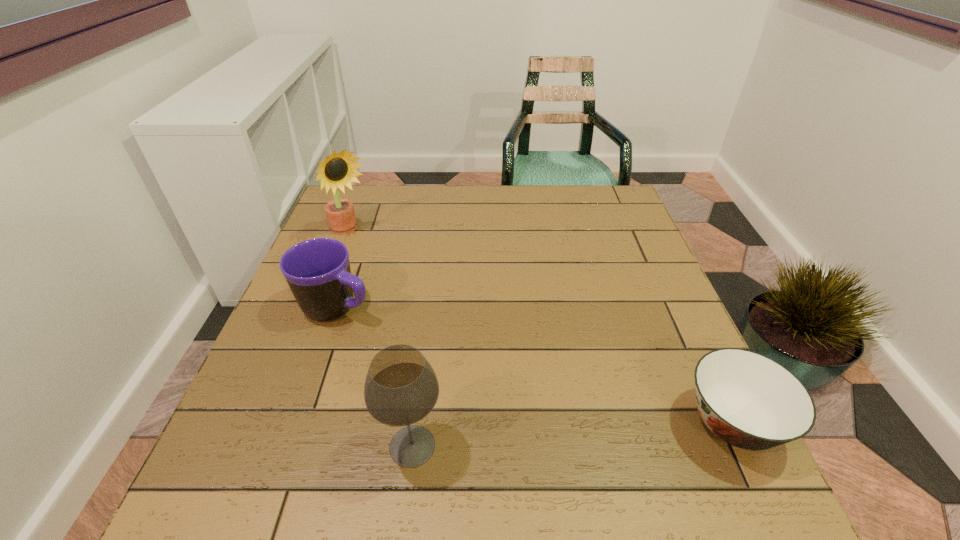
Locate an element on the screen. The height and width of the screenshot is (540, 960). the third object from left to right is located at coordinates (401, 388).

Find the location of a particular element. This screenshot has height=540, width=960. the second tallest object is located at coordinates (401, 388).

The image size is (960, 540). I want to click on the shortest object, so click(748, 400).

Locate an element on the screen. Image resolution: width=960 pixels, height=540 pixels. the rightmost object is located at coordinates (748, 400).

Find the location of `the farthest object`. the farthest object is located at coordinates (338, 170).

Locate an element on the screen. This screenshot has width=960, height=540. mug is located at coordinates (317, 270).

You are a GUI agent. You are given a task and a screenshot of the screen. Output one action in this format:
    pyautogui.click(x=<x>, y=<y>)
    Task: Click on the second shortest object
    This screenshot has width=960, height=540.
    Given the screenshot: What is the action you would take?
    pyautogui.click(x=317, y=270)

Image resolution: width=960 pixels, height=540 pixels. I want to click on vacant space located on the right of the second tallest object, so click(x=576, y=446).

At what (x,y) coordinates should I click in order to perform the action: click on vacant space located on the left of the rightmost object. Please return your answer as a coordinate pair (x, y). This screenshot has width=960, height=540. Looking at the image, I should click on (626, 423).

Where is `vacant region located 0.130m on the face of the sunflower`? The image size is (960, 540). vacant region located 0.130m on the face of the sunflower is located at coordinates (386, 268).